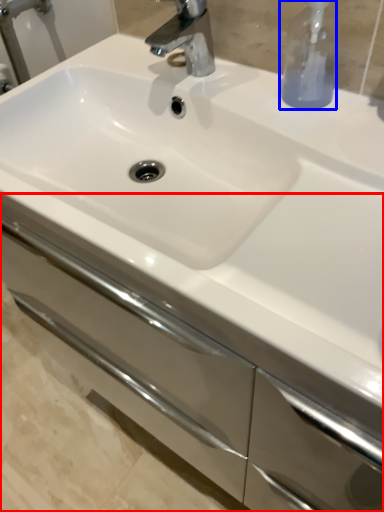
Question: Which point is further to the camera, bathroom cabinet (highlighted by a red box) or soap dispenser (highlighted by a blue box)?

Choices:
 (A) bathroom cabinet
 (B) soap dispenser

Answer: (B)